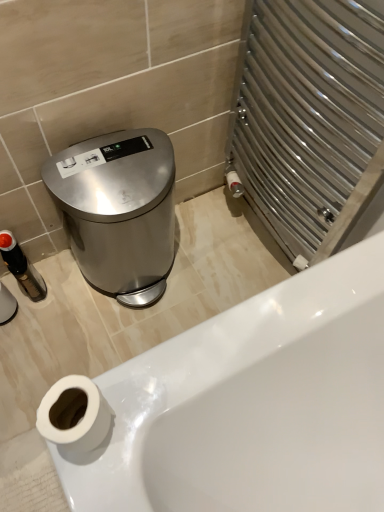
The width and height of the screenshot is (384, 512). Find the location of `free space above white glossy bathtub at lower left (from a real-world perspective)`. free space above white glossy bathtub at lower left (from a real-world perspective) is located at coordinates (127, 307).